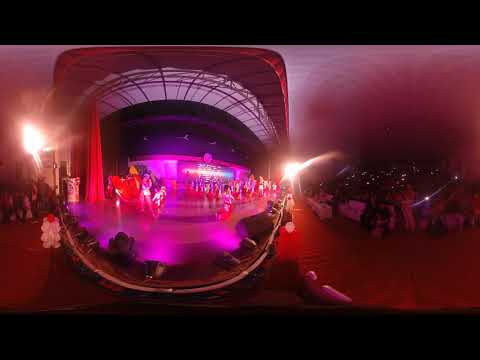
Locate an element on the screen. speakers is located at coordinates (120, 249), (257, 225), (242, 252).